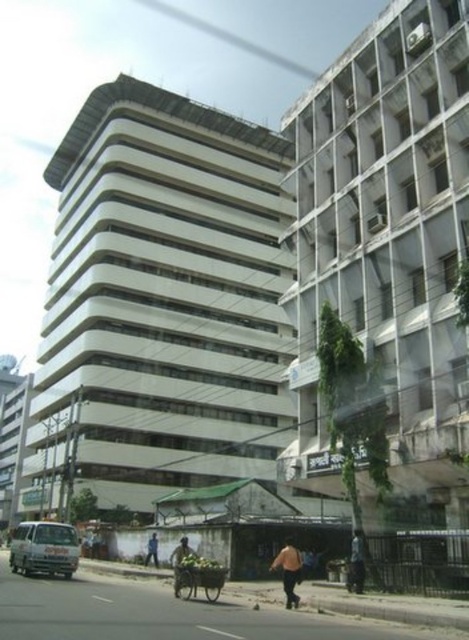
You are a delivery person needing to park your white matte van at lower left in a parking spot that can only accommodate vehicles narrower than the orange fabric bag at lower center. Can your van fit?

The white matte van at lower left is wider than the orange fabric bag at lower center, so it cannot fit into the parking spot designed for narrower vehicles.